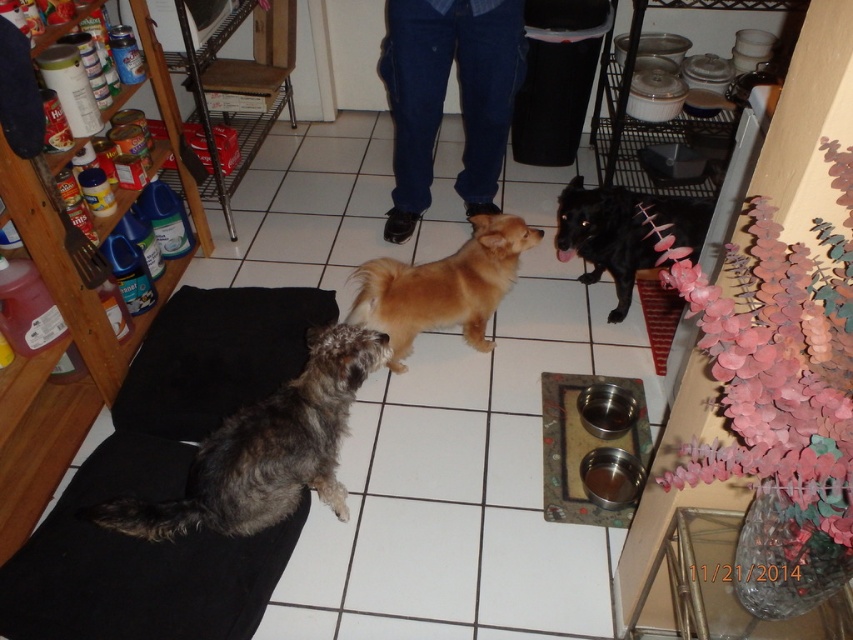
You are a photographer trying to capture a clear photo of the golden fur dog at center and the black glossy dog at center. Since you want both dogs to be in focus, which dog should you focus on first to ensure the other is also in focus?

You should focus on the black glossy dog at center first because it is farther away from the viewer than the golden fur dog at center. By focusing on the farther dog, the closer dog will also be in focus due to the depth of field extending backward.

You are a dog owner trying to decide which dog to call first. You notice the blue jeans at center and the black glossy dog at center. Which one is taller?

The blue jeans at center is taller than the black glossy dog at center.

You are a dog owner who wants to place a small toy between the blue jeans at center and the golden fur dog at center. Based on their sizes, which object should the toy be closer to?

The blue jeans at center is larger than the golden fur dog at center, so the toy should be placed closer to the golden fur dog at center to balance the sizes.